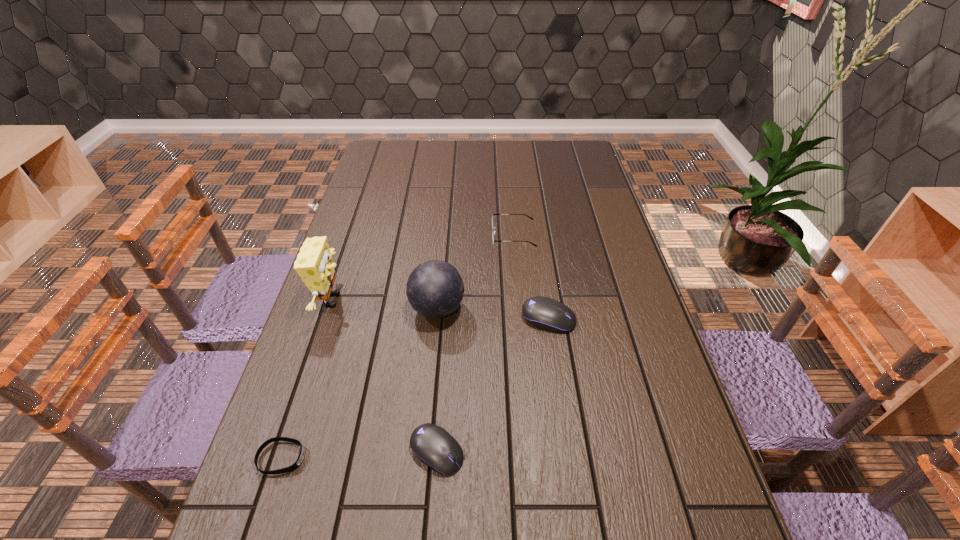
Where is `free space at the near edge of the desktop`? The width and height of the screenshot is (960, 540). free space at the near edge of the desktop is located at coordinates (437, 487).

Where is `vacant point at the left edge`? Image resolution: width=960 pixels, height=540 pixels. vacant point at the left edge is located at coordinates (x=334, y=420).

Identify the location of vacant space at the right edge. Image resolution: width=960 pixels, height=540 pixels. (607, 245).

I want to click on free space at the near left corner of the desktop, so click(x=314, y=502).

Locate an element on the screen. The width and height of the screenshot is (960, 540). vacant region at the far right corner of the desktop is located at coordinates (568, 161).

Find the location of a particular element. unoccupied area between the left computer mouse and the shortest object is located at coordinates (359, 455).

Locate an element on the screen. Image resolution: width=960 pixels, height=540 pixels. free space between the bowling ball and the taller computer mouse is located at coordinates (492, 314).

This screenshot has height=540, width=960. Identify the location of vacant space that is in between the bowling ball and the second shortest object. (437, 380).

You are a GUI agent. You are given a task and a screenshot of the screen. Output one action in this format:
    pyautogui.click(x=<x>, y=<y>)
    Task: Click on the unoccupied area between the fifth tallest object and the right computer mouse
    This screenshot has height=540, width=960.
    Given the screenshot: What is the action you would take?
    pyautogui.click(x=492, y=384)

At what (x,y) coordinates should I click in order to perform the action: click on empty space that is in between the farther computer mouse and the farthest object. Please return your answer as a coordinate pair (x, y). The image size is (960, 540). Looking at the image, I should click on (531, 277).